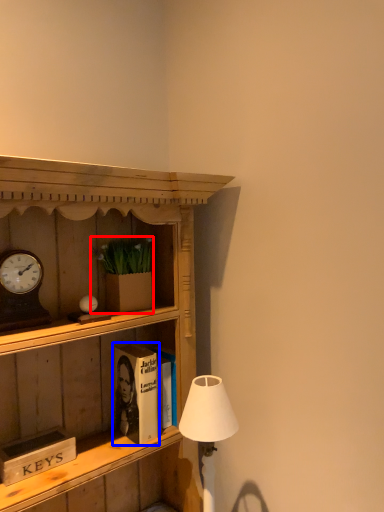
Question: Which of the following is the closest to the observer, houseplant (highlighted by a red box) or book (highlighted by a blue box)?

Choices:
 (A) houseplant
 (B) book

Answer: (A)